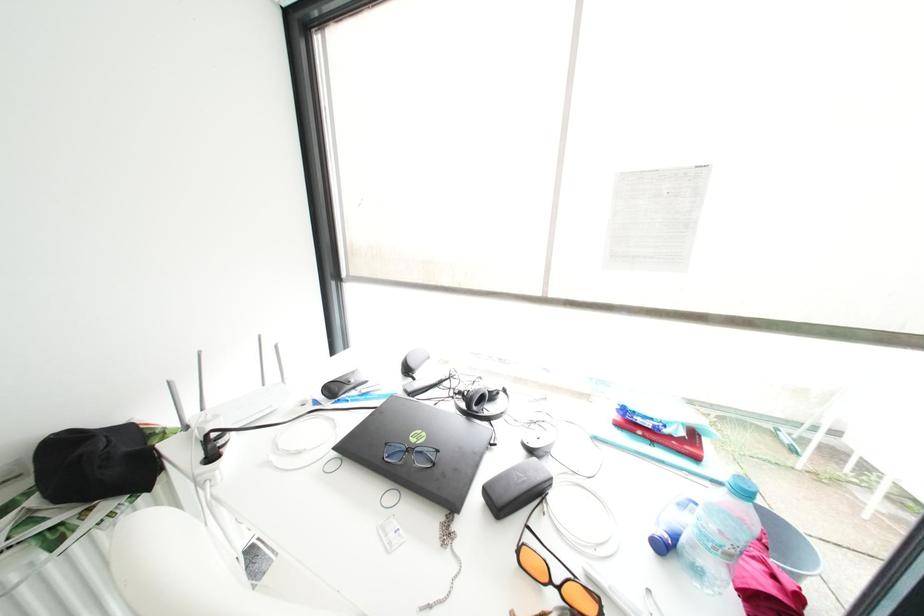
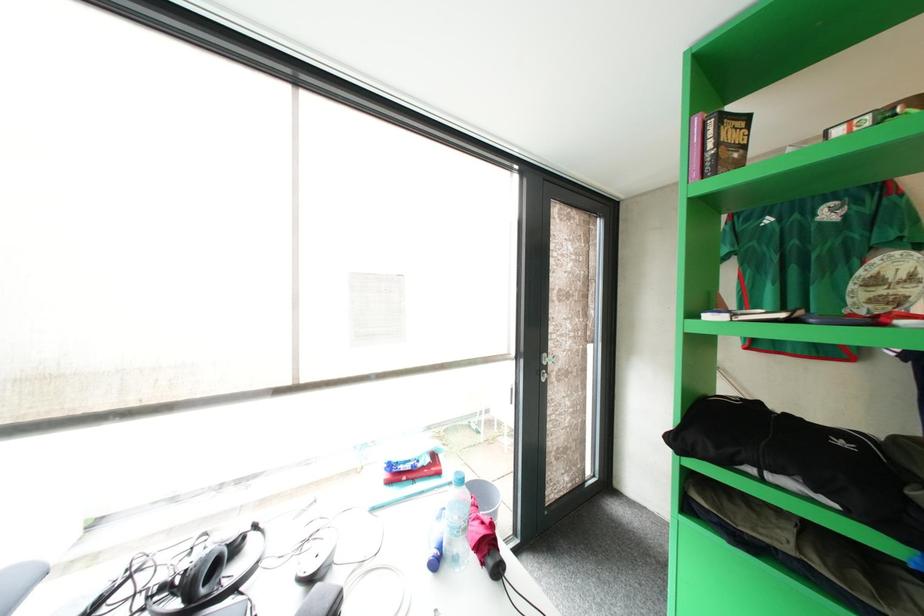
Question: How did the camera likely rotate?

Choices:
 (A) Left
 (B) Right
 (C) Up
 (D) Down

Answer: (B)